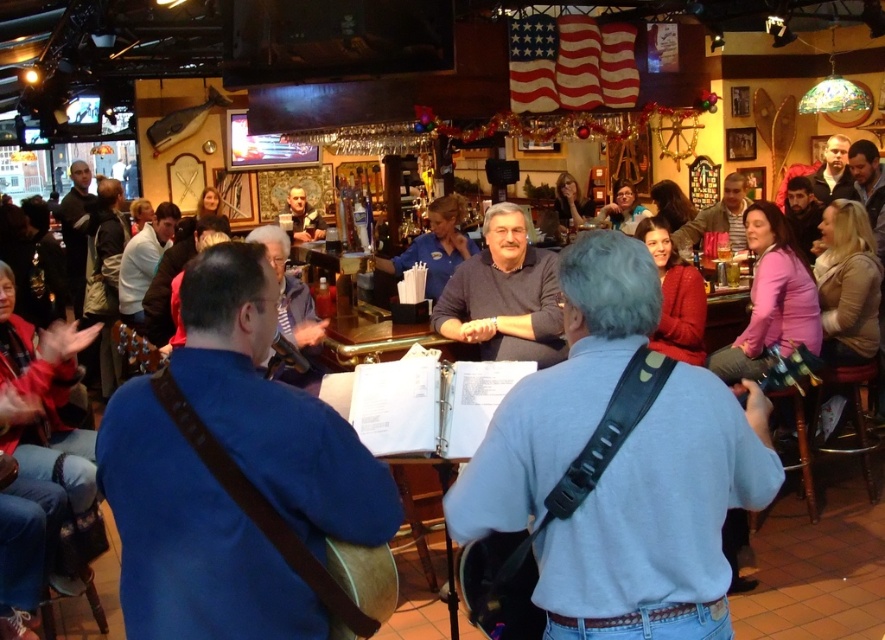
Question: Can you confirm if metallic gold guitar at center is positioned to the left of matte black sweater at upper center?

Choices:
 (A) no
 (B) yes

Answer: (B)

Question: Which object appears closest to the camera in this image?

Choices:
 (A) matte black sweater at upper center
 (B) matte black shirt at center
 (C) dark gray sweater at center
 (D) metallic gold guitar at center

Answer: (C)

Question: Which of the following is the closest to the observer?

Choices:
 (A) wooden acoustic guitar at lower left
 (B) blue shirt at center

Answer: (A)

Question: Which point is farther from the camera taking this photo?

Choices:
 (A) (445, 317)
 (B) (589, 348)
 (C) (564, 180)

Answer: (C)

Question: Can you confirm if gray sweater at center is smaller than metallic gold guitar at center?

Choices:
 (A) no
 (B) yes

Answer: (A)

Question: Is blue fabric guitar at center in front of blue shirt at center?

Choices:
 (A) yes
 (B) no

Answer: (A)